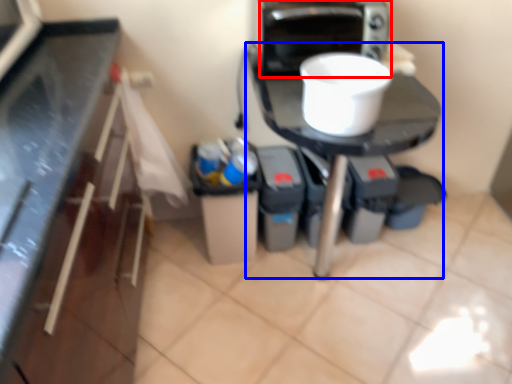
Question: Which point is further to the camera, home appliance (highlighted by a red box) or table (highlighted by a blue box)?

Choices:
 (A) home appliance
 (B) table

Answer: (A)